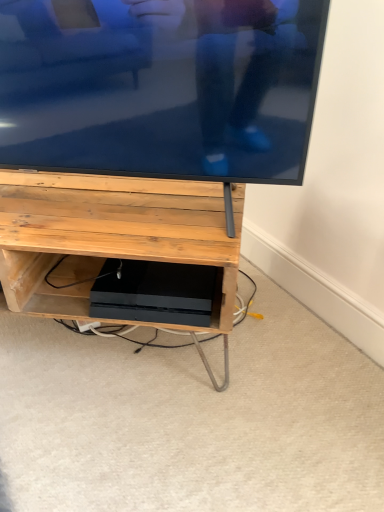
Find the location of a particular element. This screenshot has width=384, height=512. free spot below matte black tv at upper center (from a real-world perspective) is located at coordinates (117, 204).